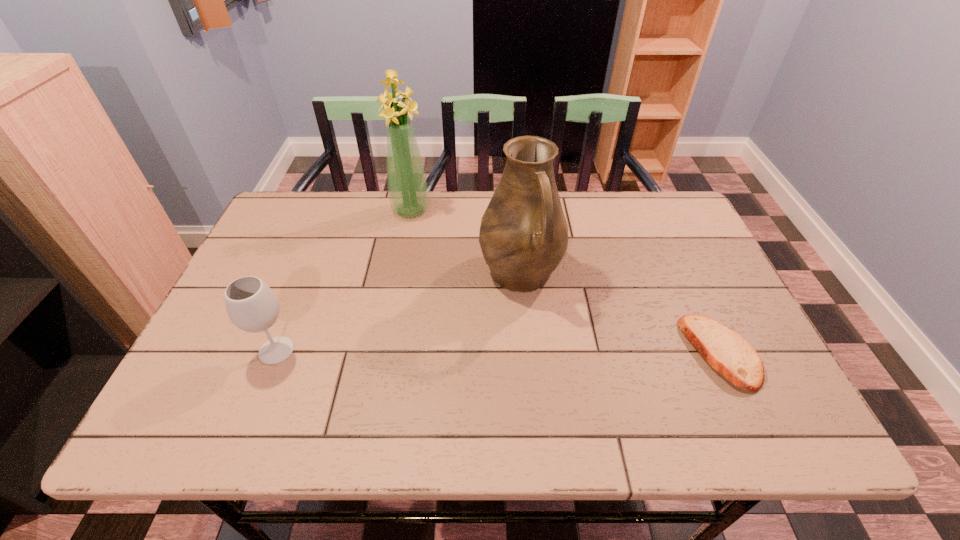
This screenshot has height=540, width=960. In order to click on vacant spot on the desktop that is between the third tallest object and the shortest object and is positioned on the front-facing side of the bouquet in this screenshot , I will do `click(443, 352)`.

Locate an element on the screen. free space on the desktop that is between the leftmost object and the rightmost object and is positioned on the handle side of the third object from left to right is located at coordinates (556, 352).